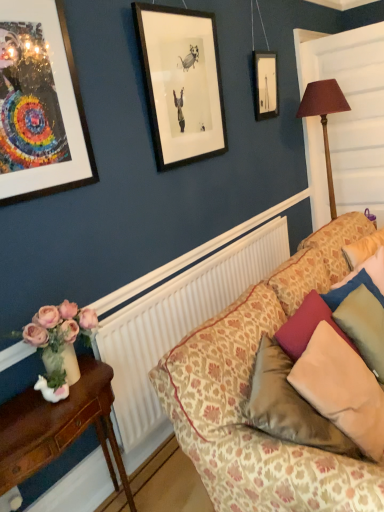
Question: Is velvet green pillow at right, which appears as the first pillow when viewed from the right, closer to the viewer compared to patterned fabric couch at lower right?

Choices:
 (A) no
 (B) yes

Answer: (A)

Question: Is velvet green pillow at right, which appears as the first pillow when viewed from the right, taller than patterned fabric couch at lower right?

Choices:
 (A) yes
 (B) no

Answer: (B)

Question: Is velvet green pillow at right, which is the second pillow from left to right, looking in the opposite direction of patterned fabric couch at lower right?

Choices:
 (A) no
 (B) yes

Answer: (B)

Question: Is velvet green pillow at right, which appears as the first pillow when viewed from the right, not close to patterned fabric couch at lower right?

Choices:
 (A) no
 (B) yes

Answer: (A)

Question: Considering the relative sizes of velvet green pillow at right, which is the second pillow from left to right, and patterned fabric couch at lower right in the image provided, is velvet green pillow at right, which is the second pillow from left to right, wider than patterned fabric couch at lower right?

Choices:
 (A) yes
 (B) no

Answer: (B)

Question: Considering the relative sizes of velvet green pillow at right, which is the second pillow from left to right, and patterned fabric couch at lower right in the image provided, is velvet green pillow at right, which is the second pillow from left to right, thinner than patterned fabric couch at lower right?

Choices:
 (A) no
 (B) yes

Answer: (B)

Question: Is the depth of velvet beige pillow at lower right, the second pillow viewed from the right, less than that of brown wooden table at lower left?

Choices:
 (A) no
 (B) yes

Answer: (B)

Question: Is velvet beige pillow at lower right, the second pillow viewed from the right, located outside brown wooden table at lower left?

Choices:
 (A) no
 (B) yes

Answer: (B)

Question: Considering the relative sizes of velvet beige pillow at lower right, the second pillow viewed from the right, and brown wooden table at lower left in the image provided, is velvet beige pillow at lower right, the second pillow viewed from the right, smaller than brown wooden table at lower left?

Choices:
 (A) yes
 (B) no

Answer: (A)

Question: From the image's perspective, does velvet beige pillow at lower right, the second pillow viewed from the right, appear higher than brown wooden table at lower left?

Choices:
 (A) no
 (B) yes

Answer: (B)

Question: Is velvet beige pillow at lower right, arranged as the first pillow when viewed from the left, bigger than brown wooden table at lower left?

Choices:
 (A) no
 (B) yes

Answer: (A)

Question: Is velvet beige pillow at lower right, arranged as the first pillow when viewed from the left, far from brown wooden table at lower left?

Choices:
 (A) yes
 (B) no

Answer: (B)

Question: Is patterned fabric couch at lower right not inside velvet beige pillow at lower right, arranged as the first pillow when viewed from the left?

Choices:
 (A) yes
 (B) no

Answer: (A)